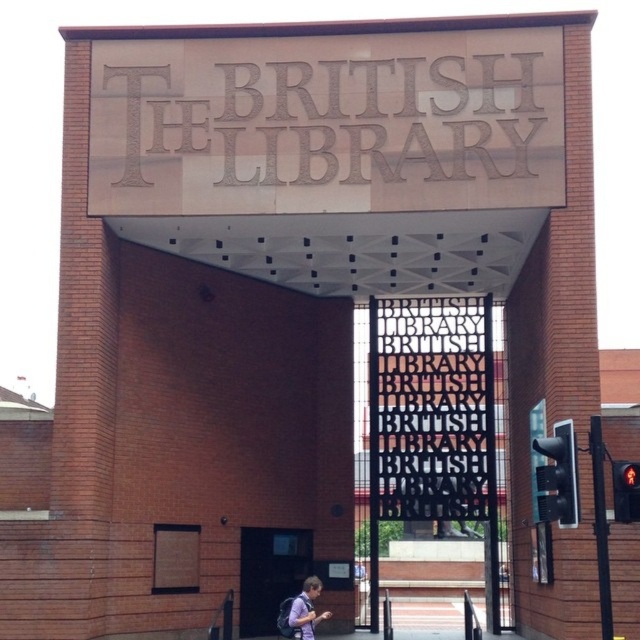
Question: Can you confirm if matte stone sign at center is bigger than black matte door at lower center?

Choices:
 (A) yes
 (B) no

Answer: (A)

Question: Does black metal sign at center have a lesser width compared to black matte door at lower center?

Choices:
 (A) no
 (B) yes

Answer: (A)

Question: Which object is the closest to the black metal sign at center?

Choices:
 (A) black matte door at lower center
 (B) matte stone sign at center
 (C) purple fabric backpack at lower center

Answer: (A)

Question: Is black metal sign at center to the right of black matte door at lower center from the viewer's perspective?

Choices:
 (A) no
 (B) yes

Answer: (B)

Question: Based on their relative distances, which object is nearer to the black metal sign at center?

Choices:
 (A) purple fabric backpack at lower center
 (B) black matte door at lower center

Answer: (B)

Question: Which point is closer to the camera?

Choices:
 (A) (312, 586)
 (B) (141, 58)

Answer: (A)